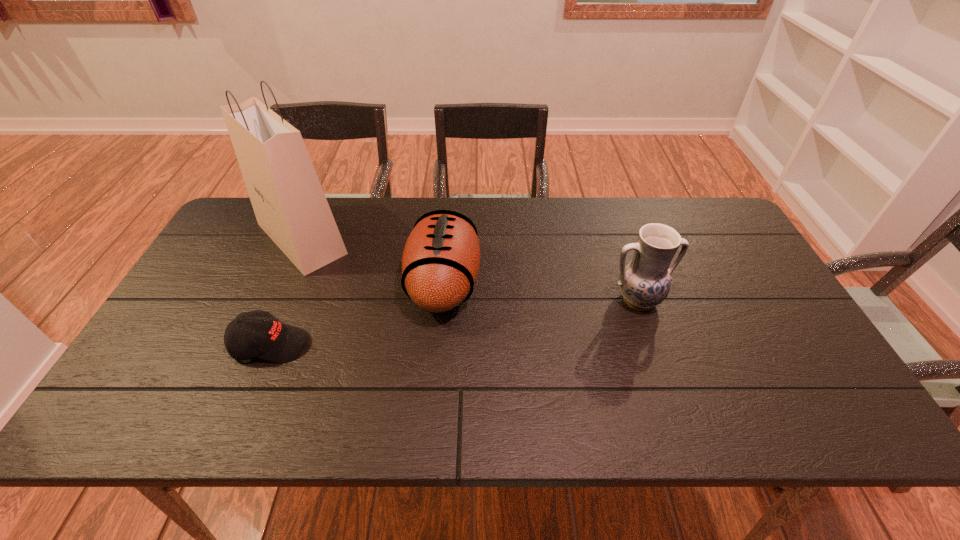
The height and width of the screenshot is (540, 960). Identify the location of football (American) present at the far edge. (440, 264).

Identify the location of object present at the left edge. Image resolution: width=960 pixels, height=540 pixels. (290, 206).

Image resolution: width=960 pixels, height=540 pixels. In order to click on object that is at the far left corner in this screenshot , I will do `click(290, 206)`.

What are the coordinates of `free space at the far edge of the desktop` in the screenshot? It's located at (360, 213).

You are a GUI agent. You are given a task and a screenshot of the screen. Output one action in this format:
    pyautogui.click(x=<x>, y=<y>)
    Task: Click on the free space at the near edge of the desktop
    The height and width of the screenshot is (540, 960).
    Given the screenshot: What is the action you would take?
    pyautogui.click(x=774, y=431)

Identify the location of vacant region at the left edge. (154, 372).

The height and width of the screenshot is (540, 960). Identify the location of vacant region at the right edge of the desktop. (752, 338).

I want to click on blank space at the far left corner of the desktop, so 223,244.

In the image, there is a desktop. Where is `vacant region at the near left corner`? The width and height of the screenshot is (960, 540). vacant region at the near left corner is located at coordinates (108, 426).

Identify the location of free area in between the shopping bag and the football (American). (372, 261).